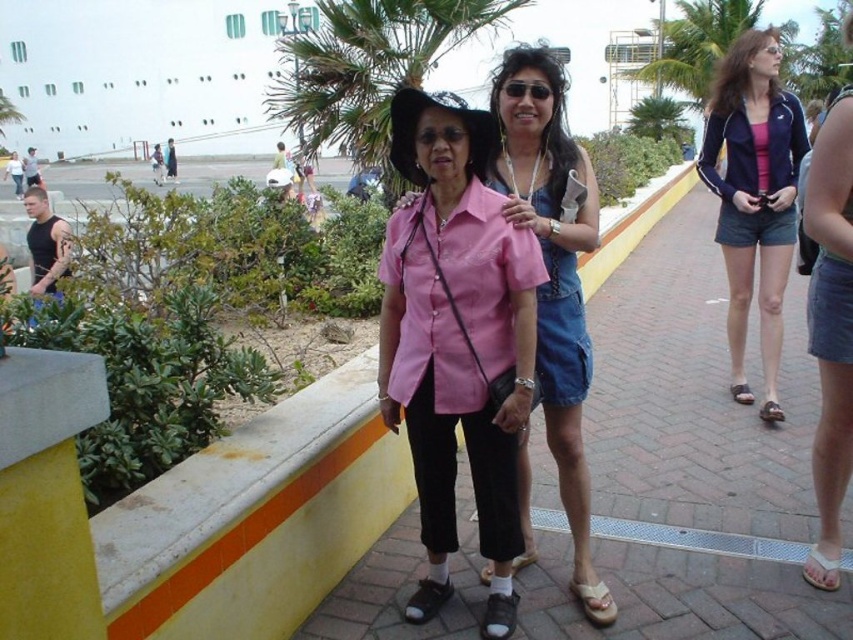
You are a photographer trying to capture a photo of the cruise ship in the background. You notice the pink matte shirt at center and the matte black sandal at lower right in your frame. Which object should you adjust your focus to ensure the cruise ship is clearly visible?

The pink matte shirt at center is taller than the matte black sandal at lower right, so adjusting focus to the pink matte shirt at center will help ensure the cruise ship in the background is clearly visible.

You are a photographer positioned at the center of the walkway. You want to take a photo of the pink matte shirt at center. Where should you aim your camera to capture it perfectly?

You should aim your camera at the coordinates point [456,324] to capture the pink matte shirt at center perfectly.

You are a photographer positioned at point (x=456, y=324). You want to capture both the woman on the left and the woman on the right in your shot. Since you are at this specific point, can you see both women clearly?

At point (x=456, y=324) lies pink matte shirt at center, which may block your view of the women. It is possible that the pink matte shirt at center could obstruct your line of sight to one or both women.